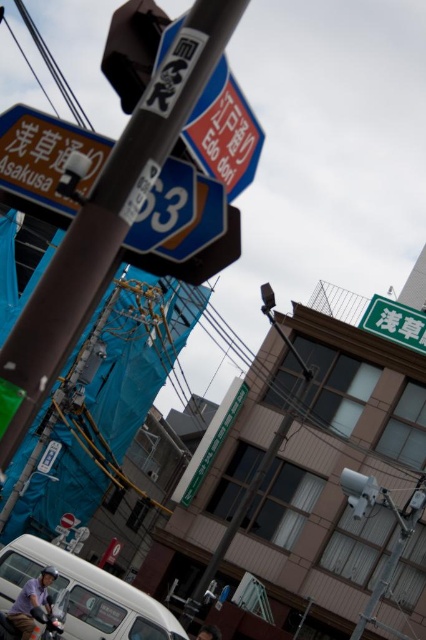
Between point (218, 22) and point (55, 589), which one is positioned in front?

Positioned in front is point (218, 22).

Describe the element at coordinates (103, 227) in the screenshot. The width and height of the screenshot is (426, 640). I see `metallic pole at center` at that location.

Between point (49, 371) and point (63, 573), which one is positioned behind?

The point (63, 573) is more distant.

Where is `metallic pole at center`? metallic pole at center is located at coordinates (103, 227).

Who is taller, metallic wire at center or green matte signboard at upper right?

metallic wire at center is taller.

Does metallic wire at center appear under green matte signboard at upper right?

Yes, metallic wire at center is below green matte signboard at upper right.

You are a GUI agent. You are given a task and a screenshot of the screen. Output one action in this format:
    pyautogui.click(x=<x>, y=<y>)
    Task: Click on the metallic wire at center
    The image size is (426, 640).
    Given the screenshot: What is the action you would take?
    [345, 364]

Is the position of metallic pole at center more distant than that of metallic wire at center?

No, it is in front of metallic wire at center.

Who is higher up, metallic pole at center or metallic wire at center?

metallic pole at center is higher up.

Is point (98, 204) farther from viewer compared to point (316, 358)?

No, (98, 204) is in front of (316, 358).

This screenshot has height=640, width=426. Find the location of `metallic pole at center`. metallic pole at center is located at coordinates (103, 227).